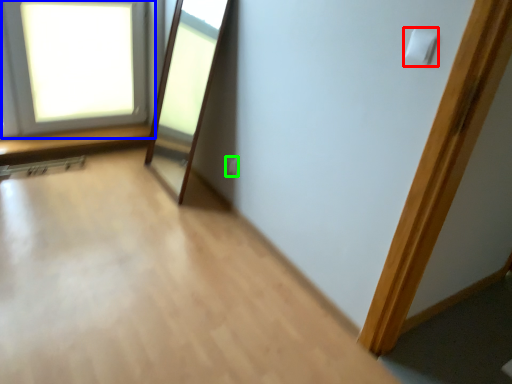
Question: Which is farther away from light switch (highlighted by a red box)? window (highlighted by a blue box) or electric outlet (highlighted by a green box)?

Choices:
 (A) window
 (B) electric outlet

Answer: (A)